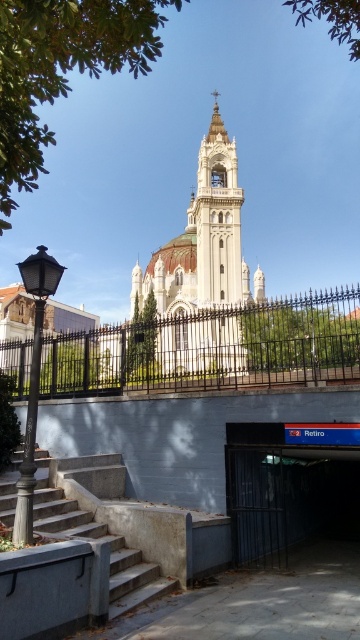
Can you confirm if black wrought iron fence at center is taller than concrete stairs at lower left?

Indeed, black wrought iron fence at center has a greater height compared to concrete stairs at lower left.

Between point (324, 300) and point (84, 531), which one is positioned behind?

Point (324, 300)

Find the location of `black wrought iron fence at center`. black wrought iron fence at center is located at coordinates (212, 349).

Is white stone tower at center below dark blue concrete entrance at lower center?

Incorrect, white stone tower at center is not positioned below dark blue concrete entrance at lower center.

In the scene shown: Does white stone tower at center have a lesser width compared to dark blue concrete entrance at lower center?

In fact, white stone tower at center might be wider than dark blue concrete entrance at lower center.

Find the location of a particular element. white stone tower at center is located at coordinates (203, 268).

I want to click on white stone tower at center, so click(203, 268).

Locate an element on the screen. The height and width of the screenshot is (640, 360). dark blue concrete entrance at lower center is located at coordinates (288, 490).